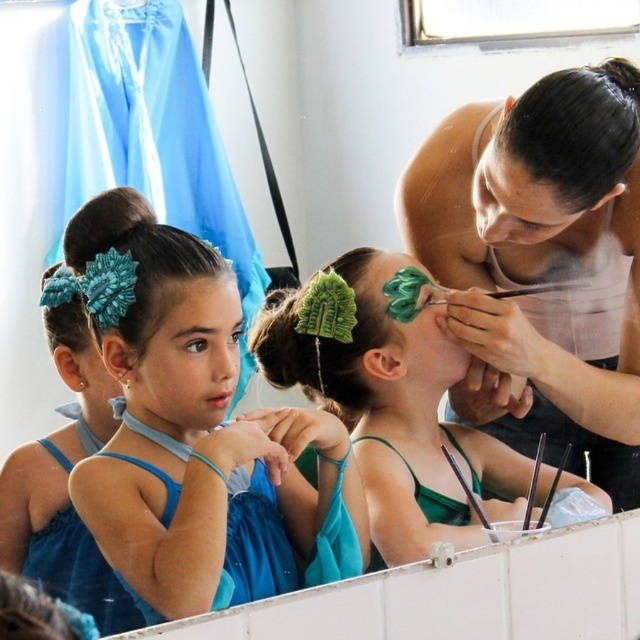
Between green matte hair clip at center and matte blue fabric at center, which one has less height?

Standing shorter between the two is green matte hair clip at center.

Find the location of a particular element. This screenshot has width=640, height=640. green matte hair clip at center is located at coordinates pos(390,401).

Measure the distance between green matte hair clip at center and camera.

5.65 feet

Identify the location of green matte hair clip at center. (390, 401).

The height and width of the screenshot is (640, 640). I want to click on black shiny hair at upper right, so click(577, 131).

Does black shiny hair at upper right have a larger size compared to green fabric flower at center?

No, black shiny hair at upper right is not bigger than green fabric flower at center.

At what (x,y) coordinates should I click in order to perform the action: click on black shiny hair at upper right. Please return your answer as a coordinate pair (x, y). The image size is (640, 640). Looking at the image, I should click on (577, 131).

Does matte blue fabric at center appear on the right side of black shiny hair at upper right?

Incorrect, matte blue fabric at center is not on the right side of black shiny hair at upper right.

Is point (76, 548) behind point (596, 176)?

Yes, point (76, 548) is behind point (596, 176).

What do you see at coordinates (65, 484) in the screenshot? I see `matte blue fabric at center` at bounding box center [65, 484].

Find the location of a particular element. matte blue fabric at center is located at coordinates (65, 484).